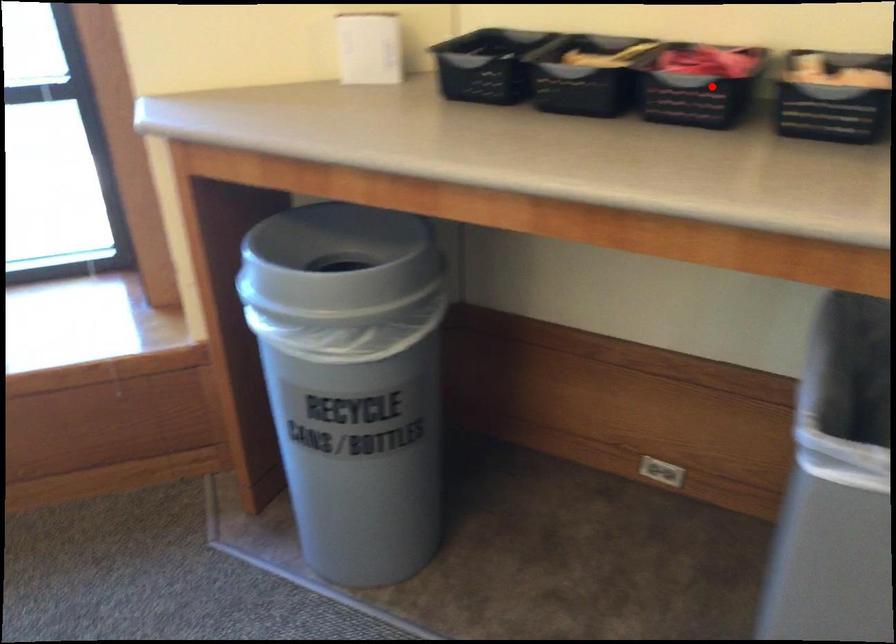
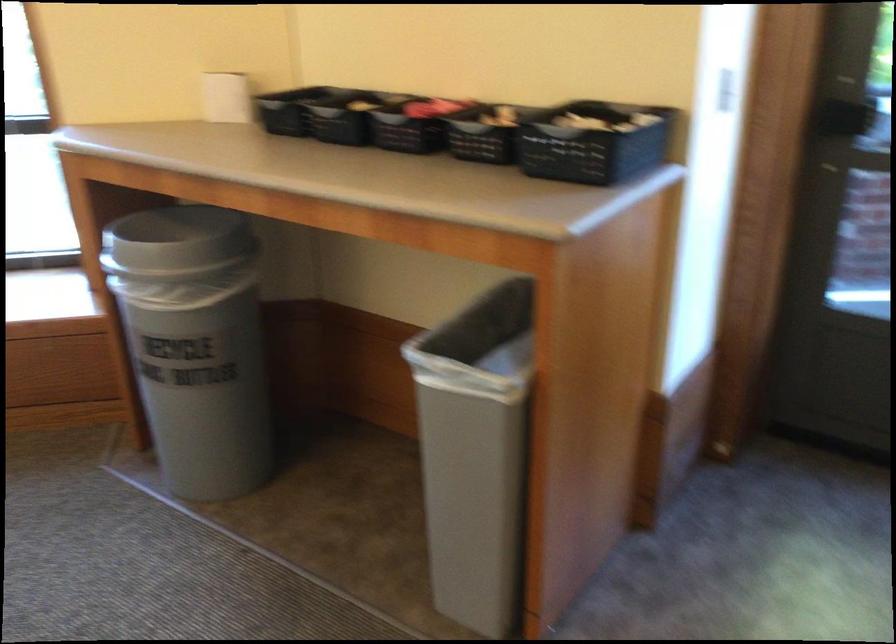
Where in the second image is the point corresponding to the highlighted location from the first image?

(410, 122)